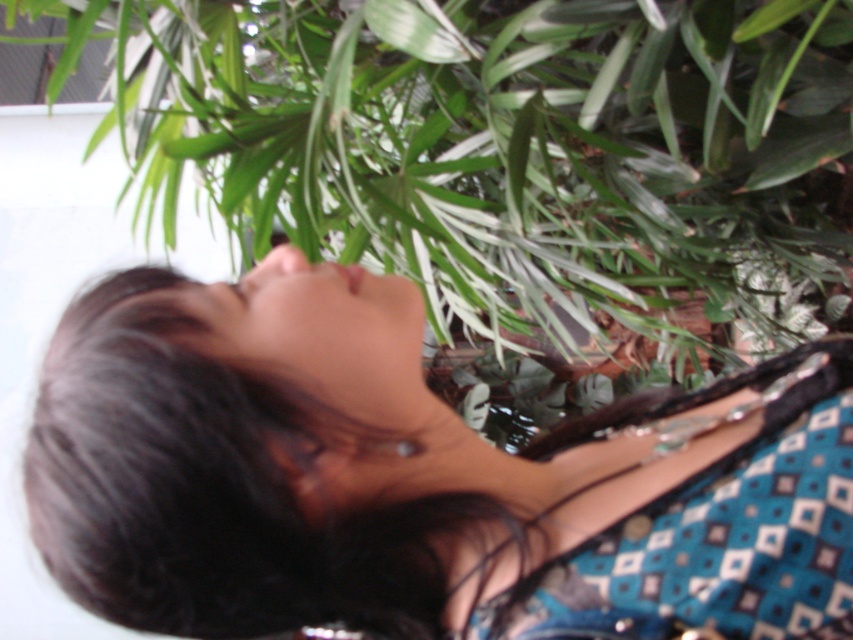
Measure the distance between blue printed dress at center and green leafy plant at upper center.

29.77 inches

Is blue printed dress at center thinner than green leafy plant at upper center?

Indeed, blue printed dress at center has a lesser width compared to green leafy plant at upper center.

Between point (714, 417) and point (286, 172), which one is positioned behind?

Positioned behind is point (286, 172).

Image resolution: width=853 pixels, height=640 pixels. Find the location of `blue printed dress at center`. blue printed dress at center is located at coordinates (415, 477).